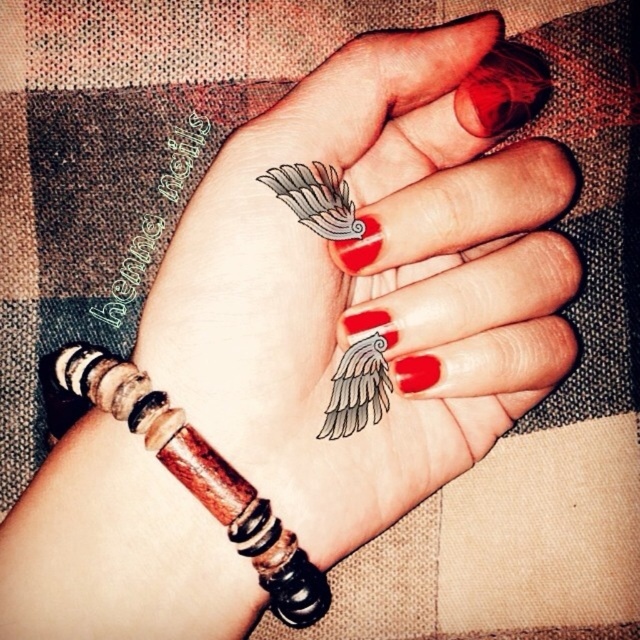
You are a jewelry designer who wants to place a new bracelet on the hand shown in the image. The bracelet is 2 cm wide. The two wings are located at the center of the back of the hand. Considering the height difference between the gray ink wing at center and the white matte wing at center, which wing should you avoid placing the bracelet over to prevent covering the taller one?

The gray ink wing at center is much taller than the white matte wing at center. To avoid covering the taller wing, you should place the bracelet over the white matte wing at center instead of the gray ink wing at center.

You are a jewelry designer who wants to create a new piece that combines both the matte black wings at center and the wooden beaded bracelet at lower left. Given their current positions and distance, do you think the two items can be connected without overlapping?

The matte black wings at center is 3.42 inches away from wooden beaded bracelet at lower left. Since the distance between them is sufficient, the two items can be connected without overlapping.

You are a jeweler examining a hand with a wooden beaded bracelet at lower left and a gray ink wing at center. Which object is wider?

The wooden beaded bracelet at lower left might be wider than gray ink wing at center.